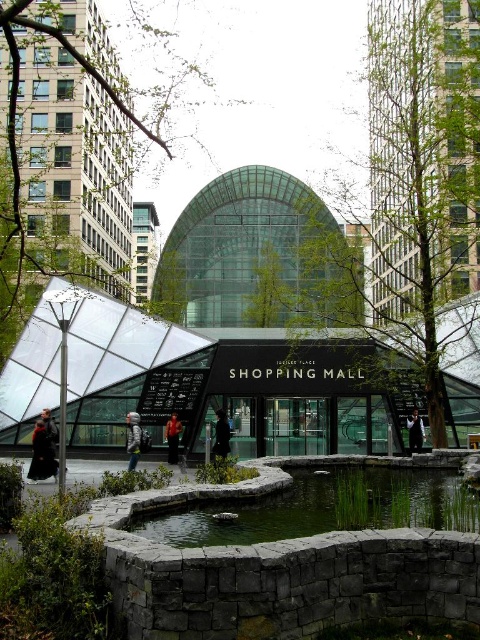
Can you confirm if dark gray stone pond at center is thinner than green stone pond at center?

Incorrect, dark gray stone pond at center's width is not less than green stone pond at center's.

Between dark gray stone pond at center and green stone pond at center, which one has more height?

Standing taller between the two is dark gray stone pond at center.

This screenshot has width=480, height=640. What do you see at coordinates (283, 564) in the screenshot? I see `dark gray stone pond at center` at bounding box center [283, 564].

Image resolution: width=480 pixels, height=640 pixels. In order to click on dark gray stone pond at center in this screenshot , I will do `click(283, 564)`.

Is denim jacket at center to the left of dark gray jacket at center from the viewer's perspective?

Correct, you'll find denim jacket at center to the left of dark gray jacket at center.

Is denim jacket at center thinner than dark gray jacket at center?

Yes, denim jacket at center is thinner than dark gray jacket at center.

What do you see at coordinates (172, 436) in the screenshot? I see `denim jacket at center` at bounding box center [172, 436].

The height and width of the screenshot is (640, 480). Identify the location of denim jacket at center. (172, 436).

Does green stone pond at center have a larger size compared to dark gray jacket at center?

Yes.

Is point (393, 480) less distant than point (408, 422)?

Yes, point (393, 480) is closer to viewer.

You are a GUI agent. You are given a task and a screenshot of the screen. Output one action in this format:
    pyautogui.click(x=<x>, y=<y>)
    Task: Click on the green stone pond at center
    The image size is (480, 640).
    Given the screenshot: What is the action you would take?
    pyautogui.click(x=322, y=508)

Locate an element on the screen. The height and width of the screenshot is (640, 480). green stone pond at center is located at coordinates pos(322,508).